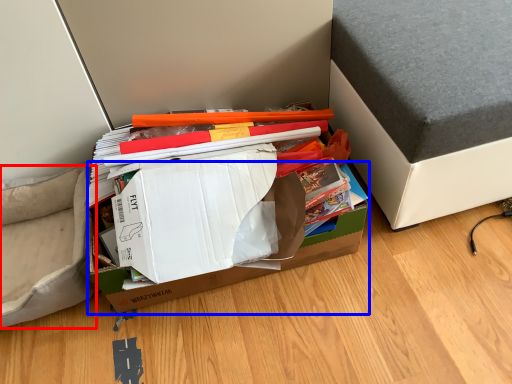
Question: Which point is closer to the camera, armchair (highlighted by a red box) or cardboard box (highlighted by a blue box)?

Choices:
 (A) armchair
 (B) cardboard box

Answer: (B)